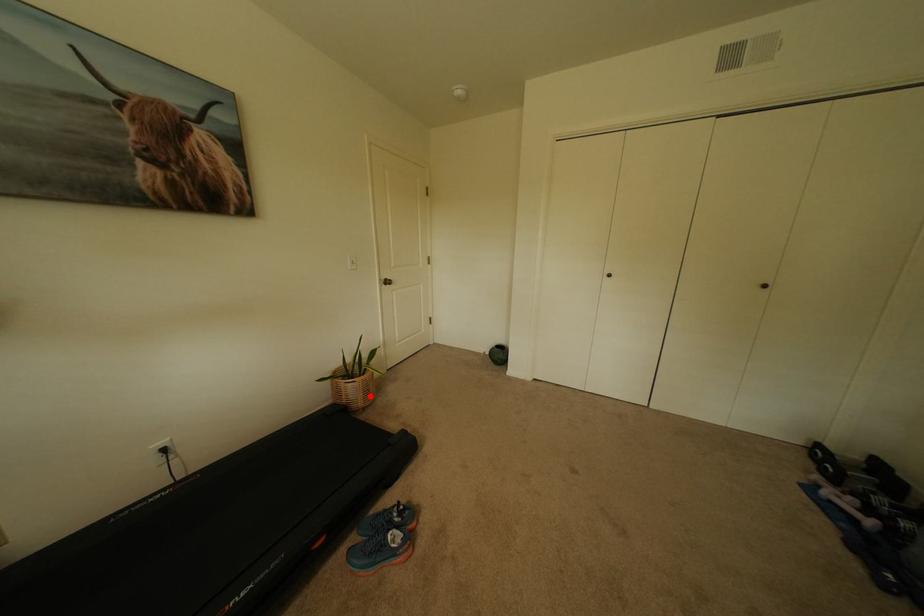
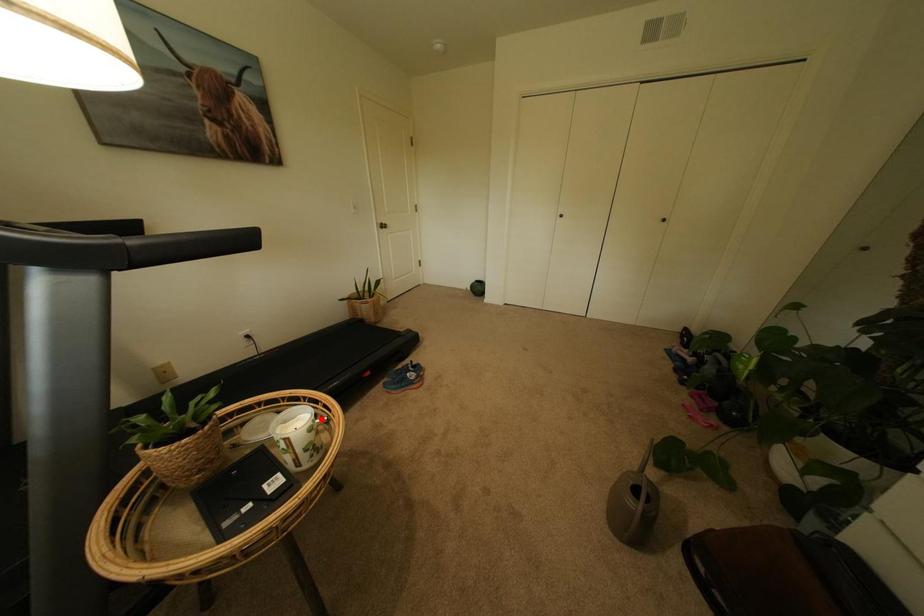
I am providing you with two images of the same scene from different viewpoints. A red point is marked on the first image and another point is marked on the second image. Is the marked point in image1 the same physical position as the marked point in image2?

No